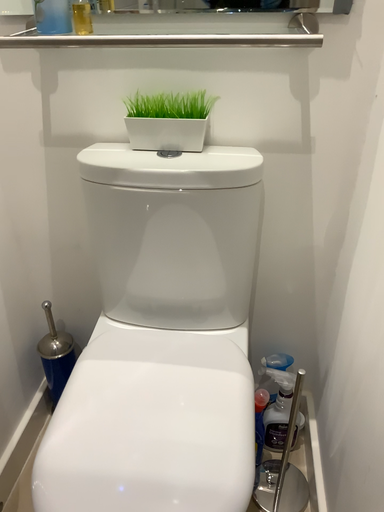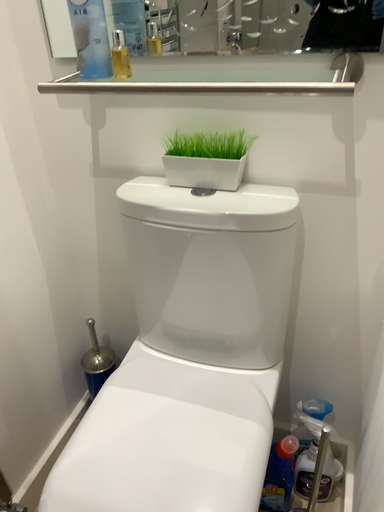
Question: Which way did the camera rotate in the video?

Choices:
 (A) rotated left
 (B) rotated right

Answer: (A)